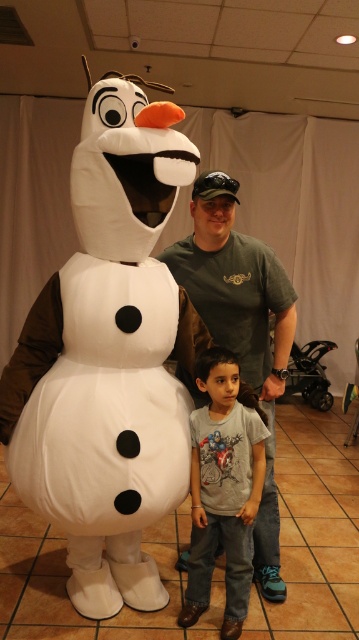
Does green cotton t-shirt at center have a larger size compared to gray cotton shirt at center?

Correct, green cotton t-shirt at center is larger in size than gray cotton shirt at center.

Is point (216, 280) farther from viewer compared to point (258, 461)?

That is True.

Locate an element on the screen. The height and width of the screenshot is (640, 359). green cotton t-shirt at center is located at coordinates (240, 326).

Find the location of a particular element. The width and height of the screenshot is (359, 640). green cotton t-shirt at center is located at coordinates (240, 326).

Which is more to the left, white plush snowman at center or gray cotton shirt at center?

white plush snowman at center

Does white plush snowman at center have a greater height compared to gray cotton shirt at center?

Indeed, white plush snowman at center has a greater height compared to gray cotton shirt at center.

Is point (136, 400) in front of point (192, 554)?

Yes, point (136, 400) is in front of point (192, 554).

The height and width of the screenshot is (640, 359). Find the location of `white plush snowman at center`. white plush snowman at center is located at coordinates (109, 356).

Can you confirm if white plush snowman at center is positioned to the left of green cotton t-shirt at center?

Correct, you'll find white plush snowman at center to the left of green cotton t-shirt at center.

Based on the photo, does white plush snowman at center appear on the right side of green cotton t-shirt at center?

In fact, white plush snowman at center is to the left of green cotton t-shirt at center.

Describe the element at coordinates (109, 356) in the screenshot. The image size is (359, 640). I see `white plush snowman at center` at that location.

Locate an element on the screen. white plush snowman at center is located at coordinates (109, 356).